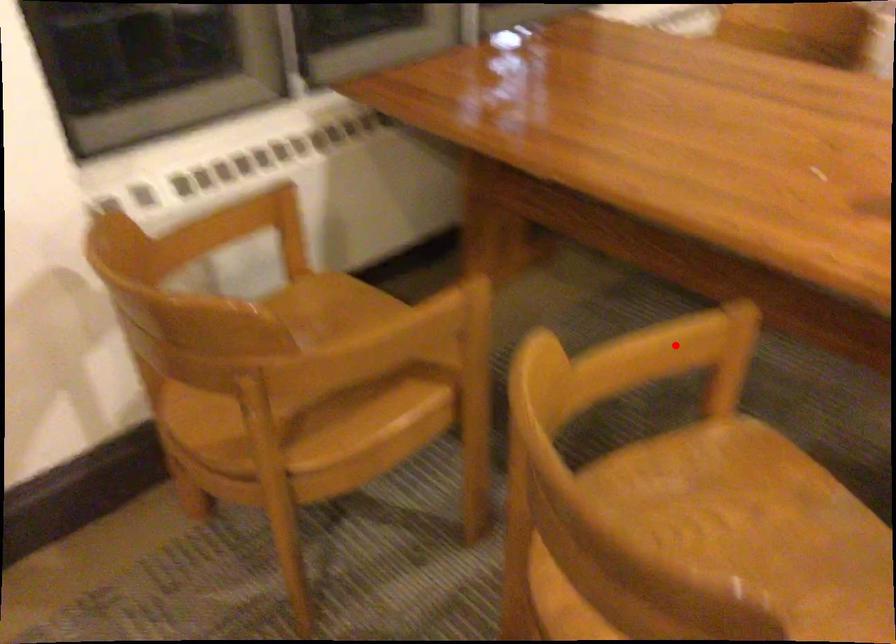
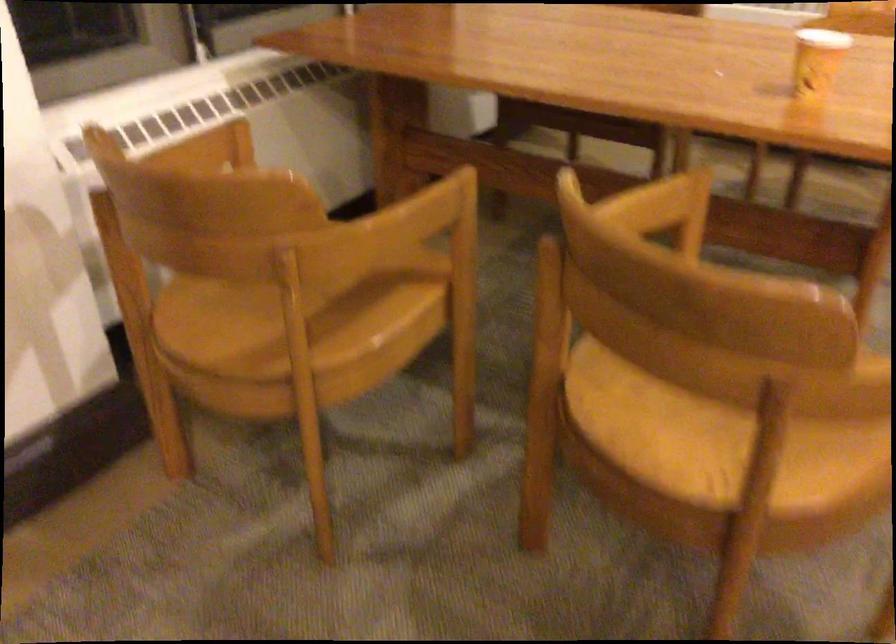
Find the pixel in the second image that matches the highlighted location in the first image.

(650, 205)